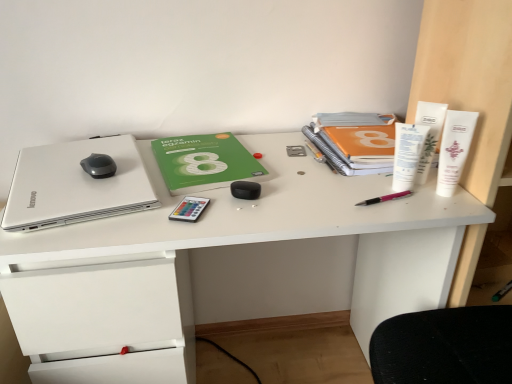
The width and height of the screenshot is (512, 384). I want to click on free space to the left of black rubberized mouse at upper left, so click(46, 167).